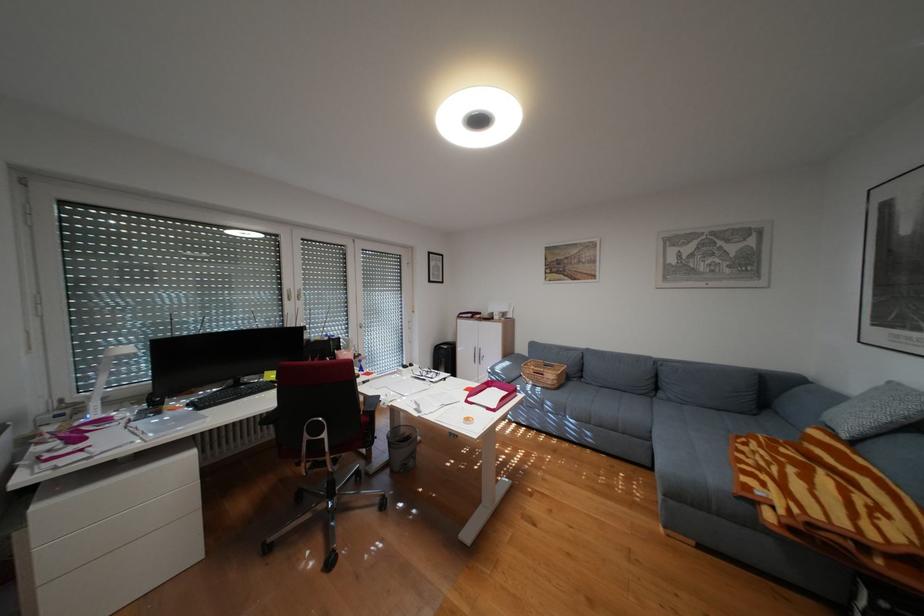
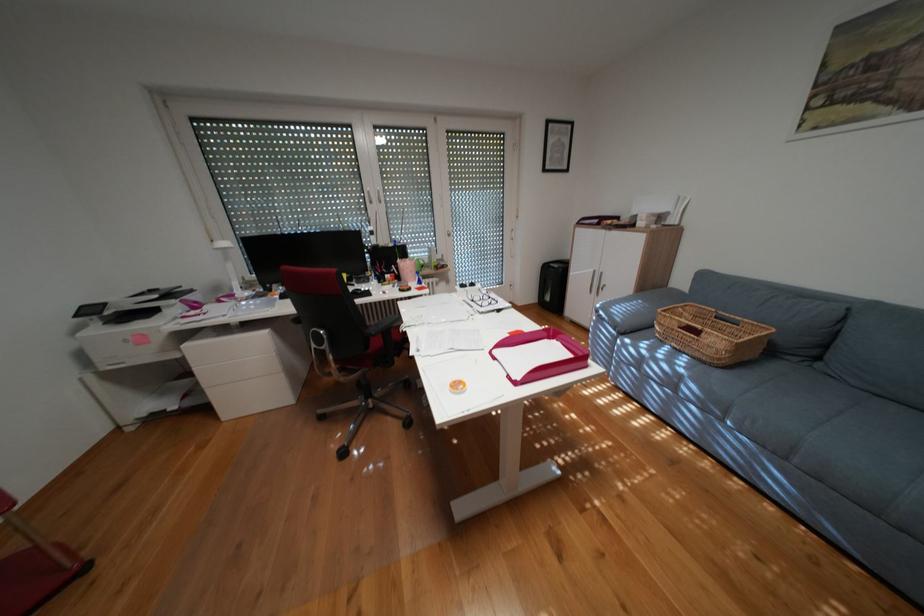
How did the camera likely rotate?

The rotation direction of the camera is left-down.